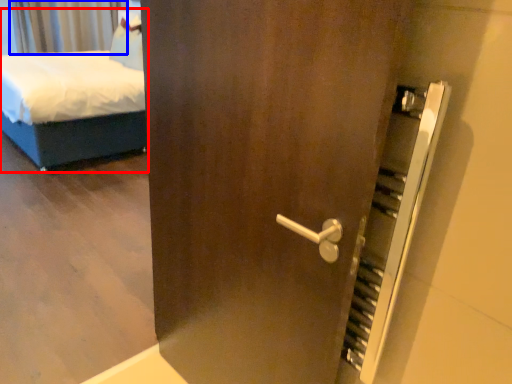
Question: Which object appears closest to the camera in this image, bed (highlighted by a red box) or curtain (highlighted by a blue box)?

Choices:
 (A) bed
 (B) curtain

Answer: (A)